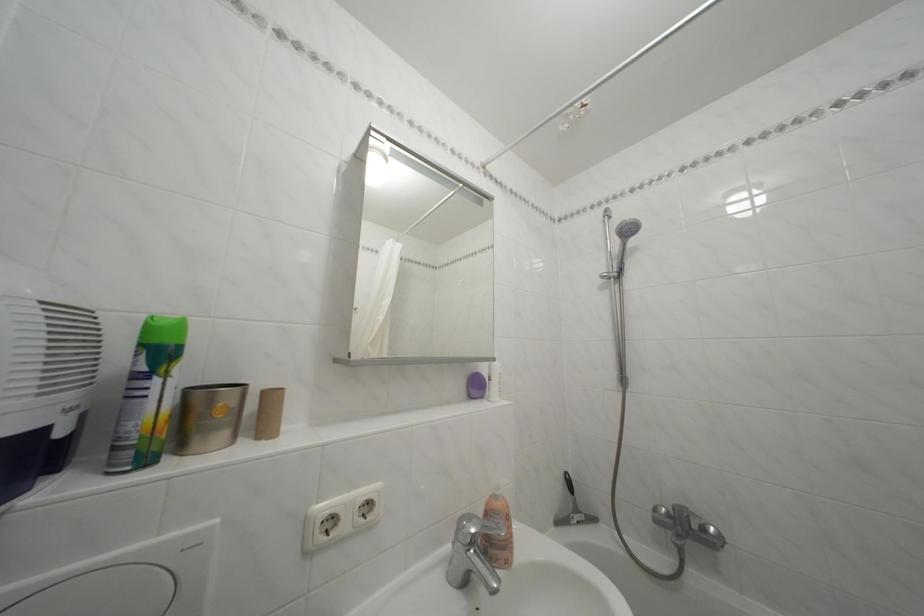
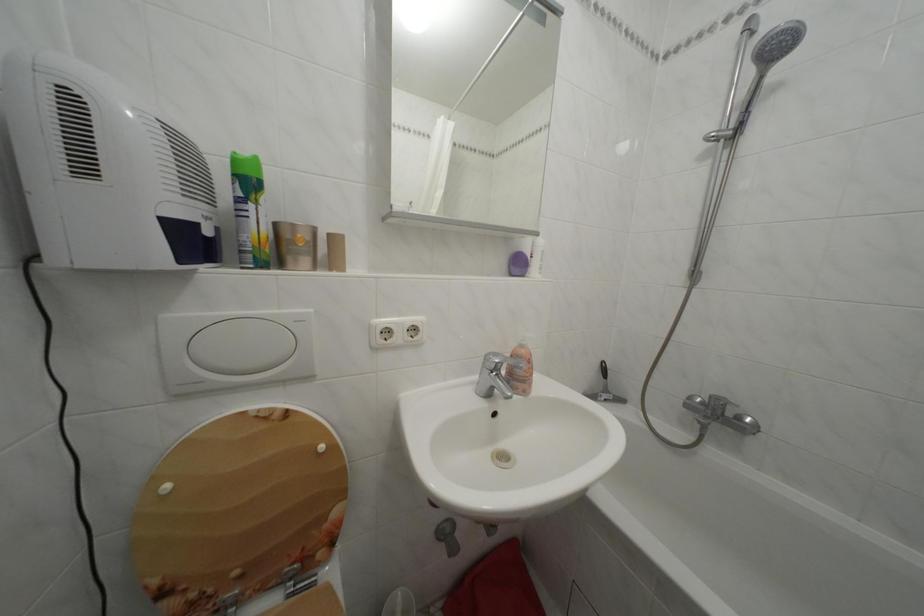
The point at (x=586, y=517) is marked in the first image. Where is the corresponding point in the second image?

(614, 397)